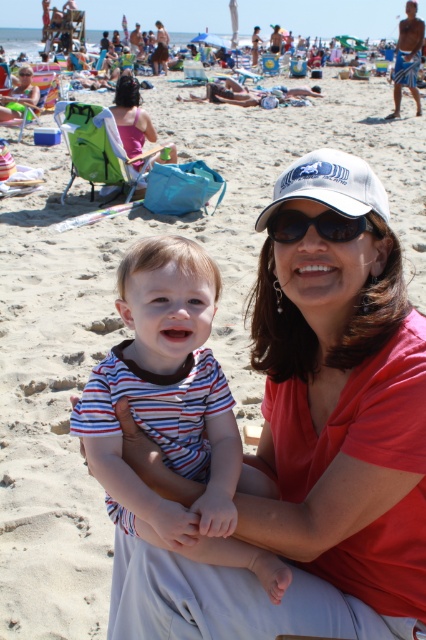
You are a photographer standing at the beach. You want to take a photo of the striped cotton shirt at center and the white mesh baseball cap at center. Which object should you focus on first to ensure both are in focus?

You should focus on the striped cotton shirt at center first because it is closer to the viewer than the white mesh baseball cap at center, so adjusting focus from near to far will help both be in focus.

You are a photographer trying to capture a clear shot of the black plastic sunglasses at center and the pink fabric chair at upper left. Which object should you focus on first to ensure both are in sharp focus?

The black plastic sunglasses at center should be focused on first since it is in front of the pink fabric chair at upper left, allowing both to be in focus when starting with the closer object.

You are a photographer trying to capture a closeup shot of the white mesh baseball cap at center and the black plastic sunglasses at center. Since you want to focus on the cap, which object should you zoom in on more, considering their sizes?

The white mesh baseball cap at center is larger than the black plastic sunglasses at center, so you should zoom in more on the white mesh baseball cap at center to focus on it properly.